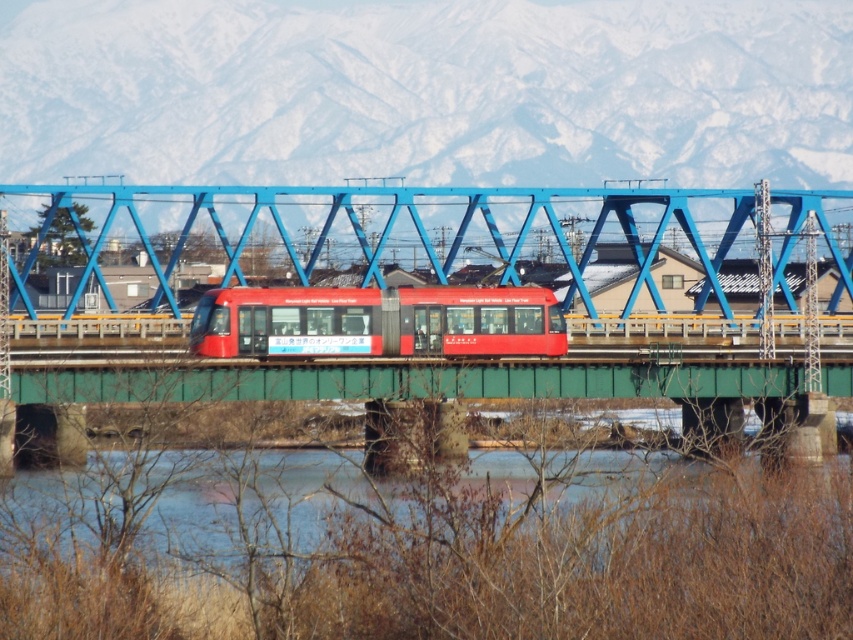
Question: Which is farther from the translucent ice at lower center?

Choices:
 (A) blue metallic bridge at center
 (B) matte red train at center

Answer: (A)

Question: Is blue metallic bridge at center smaller than matte red train at center?

Choices:
 (A) no
 (B) yes

Answer: (A)

Question: Estimate the real-world distances between objects in this image. Which object is farther from the translucent ice at lower center?

Choices:
 (A) blue metallic bridge at center
 (B) matte red train at center

Answer: (A)

Question: Does translucent ice at lower center have a larger size compared to matte red train at center?

Choices:
 (A) yes
 (B) no

Answer: (A)

Question: Is translucent ice at lower center to the right of blue metallic bridge at center from the viewer's perspective?

Choices:
 (A) no
 (B) yes

Answer: (A)

Question: Considering the real-world distances, which object is closest to the matte red train at center?

Choices:
 (A) blue metallic bridge at center
 (B) translucent ice at lower center

Answer: (B)